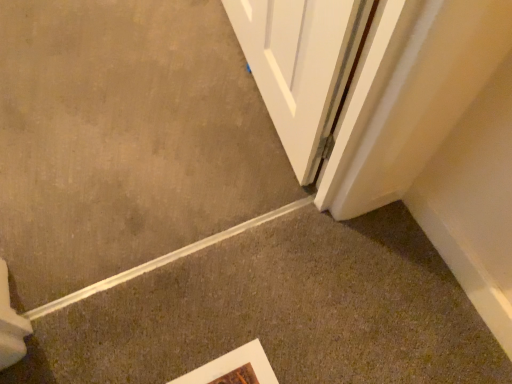
What do you see at coordinates (124, 138) in the screenshot?
I see `smooth beige carpet at center` at bounding box center [124, 138].

Image resolution: width=512 pixels, height=384 pixels. I want to click on smooth beige carpet at center, so click(124, 138).

Identify the location of smooth beige carpet at center. Image resolution: width=512 pixels, height=384 pixels. (124, 138).